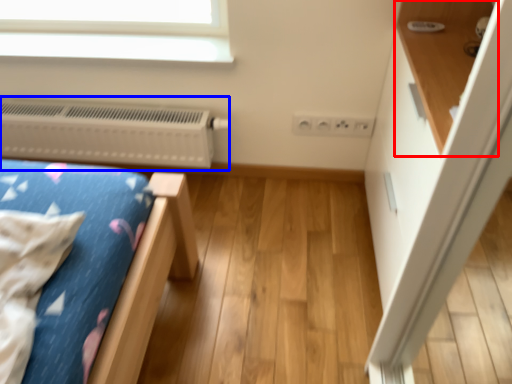
Question: Which of the following is the farthest to the observer, shelf (highlighted by a red box) or heater (highlighted by a blue box)?

Choices:
 (A) shelf
 (B) heater

Answer: (B)